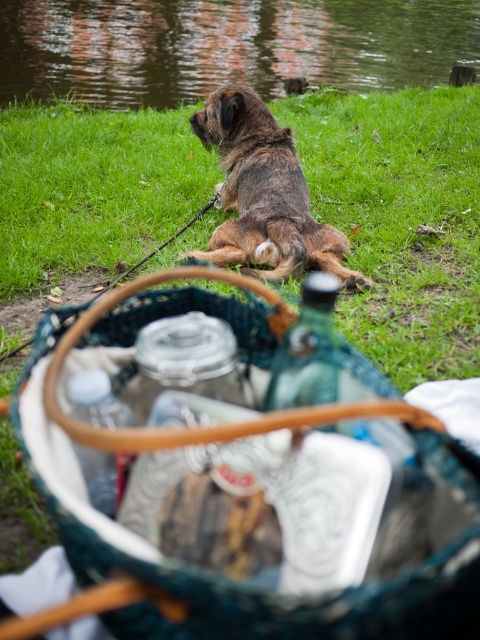
Measure the distance between green water at upper center and brown shaggy dog at center.

green water at upper center and brown shaggy dog at center are 16.97 meters apart from each other.

Describe the element at coordinates (227, 45) in the screenshot. The image size is (480, 640). I see `green water at upper center` at that location.

I want to click on green water at upper center, so click(x=227, y=45).